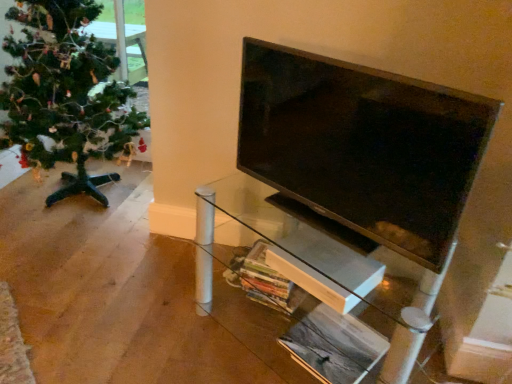
Question: Considering the relative sizes of matte black tv at center and green matte christmas tree at left in the image provided, is matte black tv at center wider than green matte christmas tree at left?

Choices:
 (A) no
 (B) yes

Answer: (A)

Question: Can you confirm if matte black tv at center is positioned to the right of green matte christmas tree at left?

Choices:
 (A) yes
 (B) no

Answer: (A)

Question: From the image's perspective, would you say matte black tv at center is positioned over green matte christmas tree at left?

Choices:
 (A) no
 (B) yes

Answer: (A)

Question: Is matte black tv at center positioned behind green matte christmas tree at left?

Choices:
 (A) no
 (B) yes

Answer: (A)

Question: From a real-world perspective, is matte black tv at center beneath green matte christmas tree at left?

Choices:
 (A) yes
 (B) no

Answer: (B)

Question: Based on their sizes in the image, would you say green matte christmas tree at left is bigger or smaller than matte black tv at center?

Choices:
 (A) big
 (B) small

Answer: (A)

Question: Is green matte christmas tree at left taller or shorter than matte black tv at center?

Choices:
 (A) short
 (B) tall

Answer: (B)

Question: From the image's perspective, is green matte christmas tree at left above or below matte black tv at center?

Choices:
 (A) below
 (B) above

Answer: (B)

Question: Is green matte christmas tree at left inside or outside of matte black tv at center?

Choices:
 (A) inside
 (B) outside

Answer: (B)

Question: In terms of height, does matte black tv at center look taller or shorter compared to transparent glass tv stand at center?

Choices:
 (A) tall
 (B) short

Answer: (B)

Question: From the image's perspective, is matte black tv at center located above or below transparent glass tv stand at center?

Choices:
 (A) below
 (B) above

Answer: (B)

Question: Is matte black tv at center to the left or to the right of transparent glass tv stand at center in the image?

Choices:
 (A) left
 (B) right

Answer: (A)

Question: Choose the correct answer: Is matte black tv at center inside transparent glass tv stand at center or outside it?

Choices:
 (A) outside
 (B) inside

Answer: (A)

Question: Is point (362, 309) positioned closer to the camera than point (68, 109)?

Choices:
 (A) farther
 (B) closer

Answer: (B)

Question: From the image's perspective, is transparent glass tv stand at center located above or below green matte christmas tree at left?

Choices:
 (A) below
 (B) above

Answer: (A)